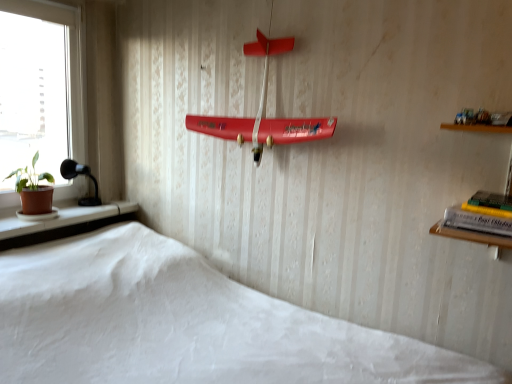
I want to click on vacant space in green matte houseplant at left (from a real-world perspective), so click(36, 219).